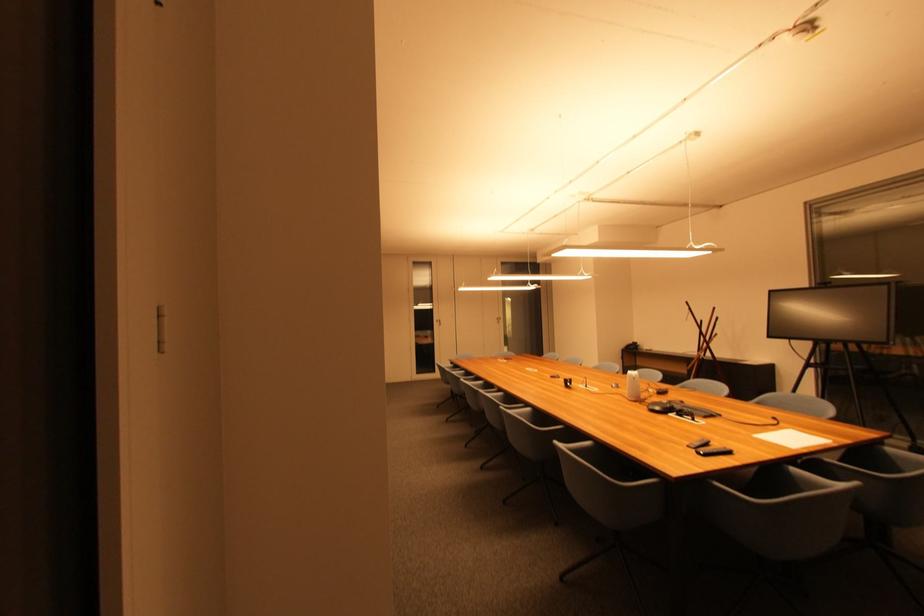
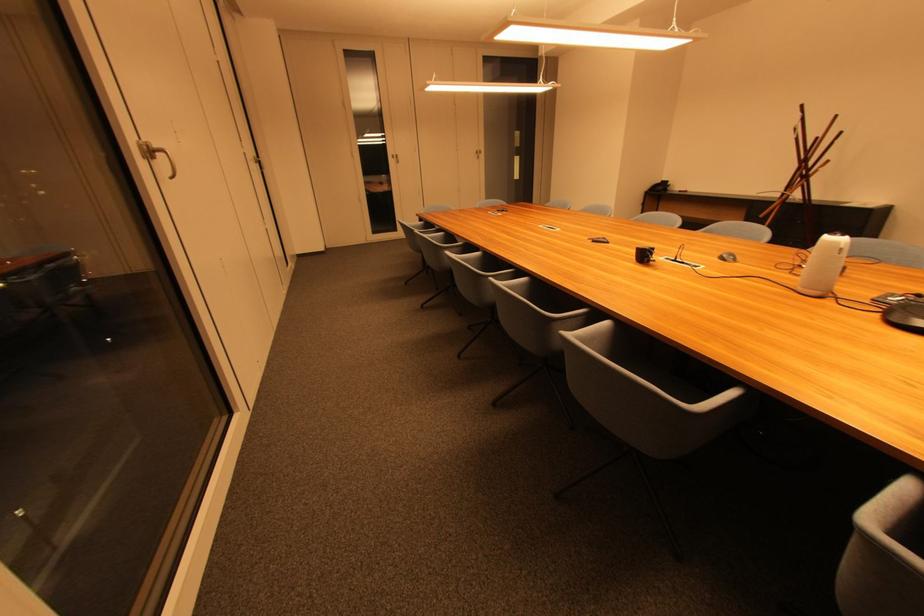
Find the pixel in the second image that matches pixel 637 377 in the first image.

(841, 245)